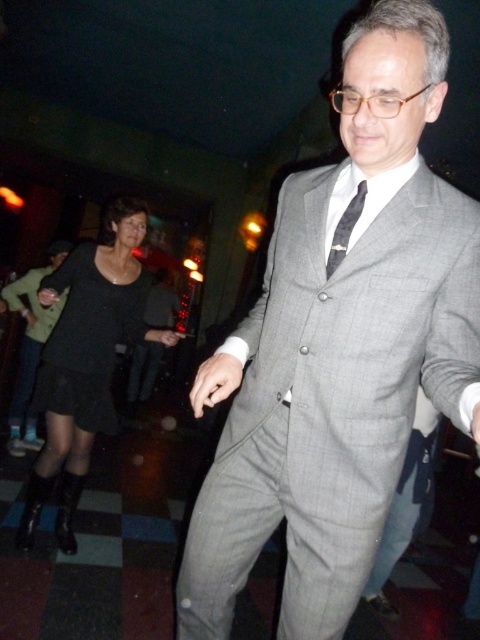
Between point (145, 326) and point (51, 248), which one is positioned behind?

The point (51, 248) is behind.

Does black matte dress at lower left have a larger size compared to matte black dress at lower left?

No, black matte dress at lower left is not bigger than matte black dress at lower left.

Does point (69, 314) lie behind point (20, 401)?

No.

Locate an element on the screen. Image resolution: width=480 pixels, height=640 pixels. black matte dress at lower left is located at coordinates (85, 358).

Does gray wool suit at center have a larger size compared to black matte dress at lower left?

Actually, gray wool suit at center might be smaller than black matte dress at lower left.

In the scene shown: Does gray wool suit at center have a lesser height compared to black matte dress at lower left?

Indeed, gray wool suit at center has a lesser height compared to black matte dress at lower left.

Describe the element at coordinates (339, 348) in the screenshot. I see `gray wool suit at center` at that location.

Locate an element on the screen. This screenshot has height=640, width=480. gray wool suit at center is located at coordinates point(339,348).

Is gray wool suit at center to the right of black silk tie at center from the viewer's perspective?

No, gray wool suit at center is not to the right of black silk tie at center.

Is gray wool suit at center below black silk tie at center?

Indeed, gray wool suit at center is positioned under black silk tie at center.

You are a GUI agent. You are given a task and a screenshot of the screen. Output one action in this format:
    pyautogui.click(x=<x>, y=<y>)
    Task: Click on the gray wool suit at center
    Image resolution: width=480 pixels, height=640 pixels.
    Given the screenshot: What is the action you would take?
    pyautogui.click(x=339, y=348)

Where is `gray wool suit at center`? Image resolution: width=480 pixels, height=640 pixels. gray wool suit at center is located at coordinates (339, 348).